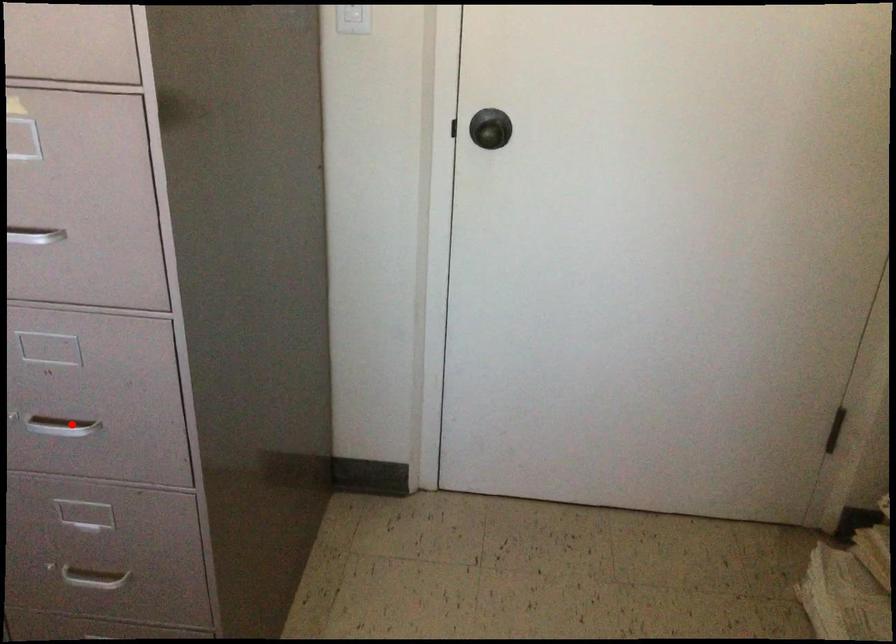
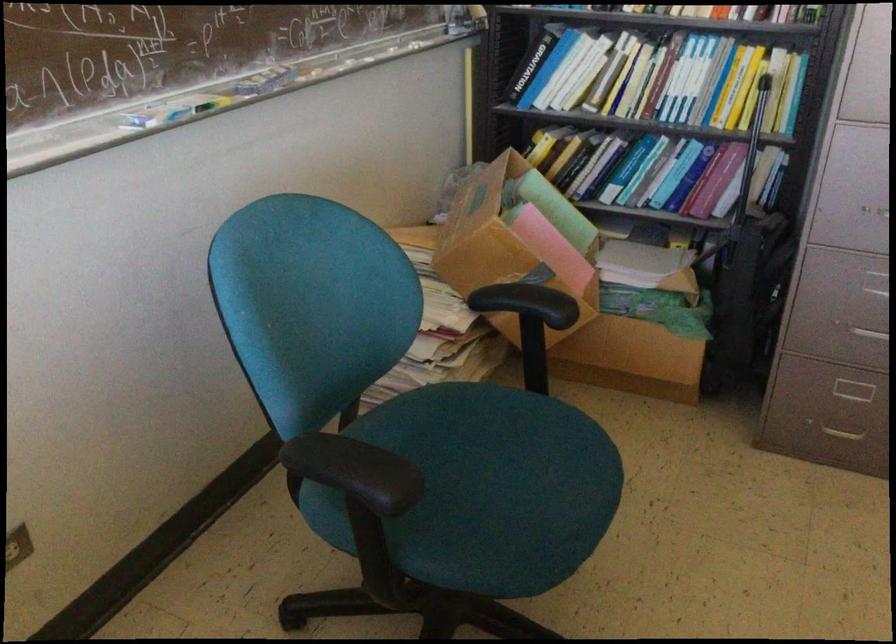
Question: A red point is marked in image1. In image2, is the corresponding 3D point closer to the camera or farther? Reply with the corresponding letter.

Choices:
 (A) The corresponding 3D point is closer.
 (B) The corresponding 3D point is farther.

Answer: (B)